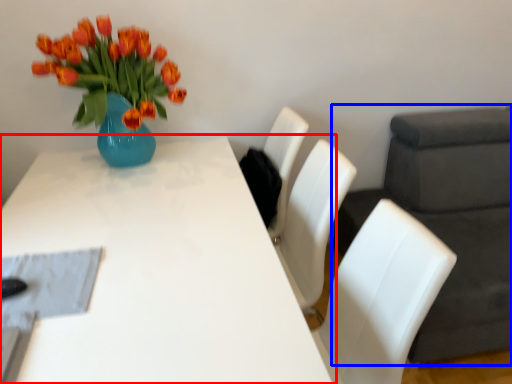
Question: Among these objects, which one is farthest to the camera, table (highlighted by a red box) or swivel chair (highlighted by a blue box)?

Choices:
 (A) table
 (B) swivel chair

Answer: (B)